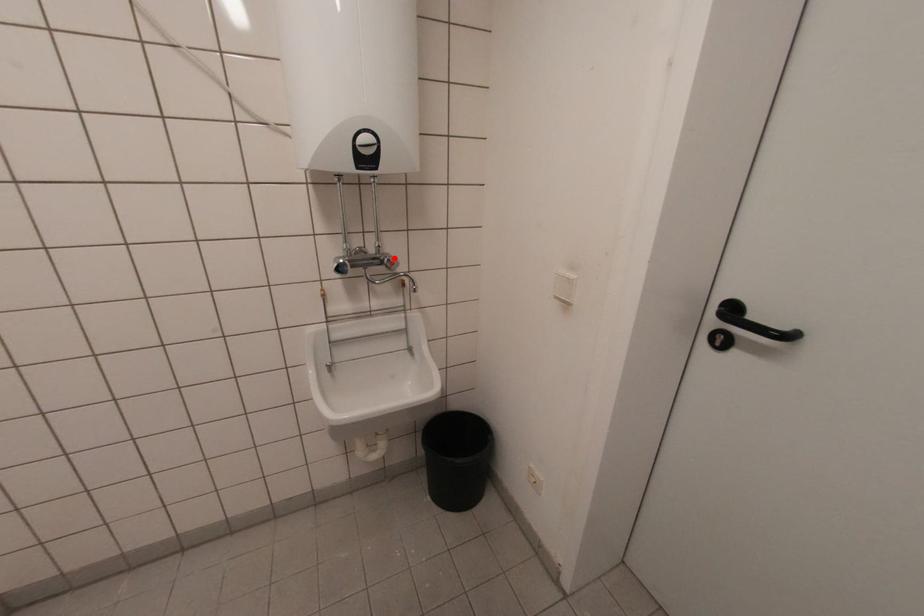
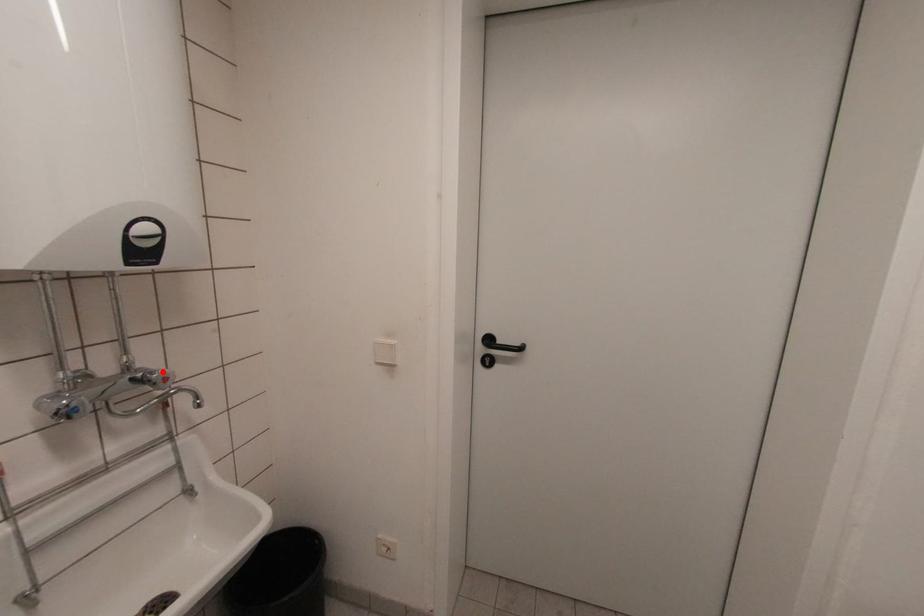
I am providing you with two images of the same scene from different viewpoints. A red point is marked on the first image and another point is marked on the second image. Is the red point in image1 aligned with the point shown in image2?

Yes